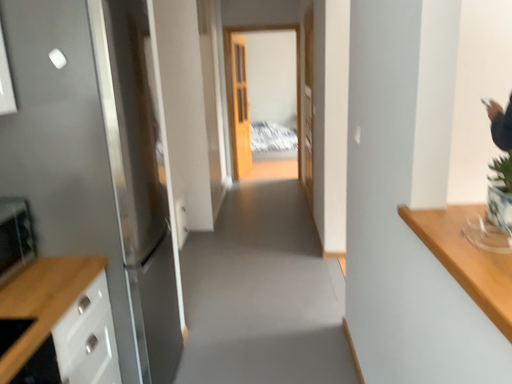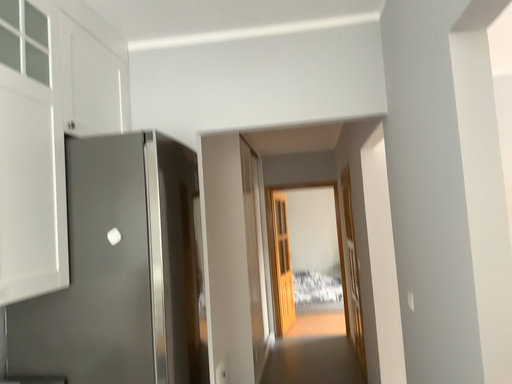
Question: How did the camera likely rotate when shooting the video?

Choices:
 (A) rotated downward
 (B) rotated upward

Answer: (B)